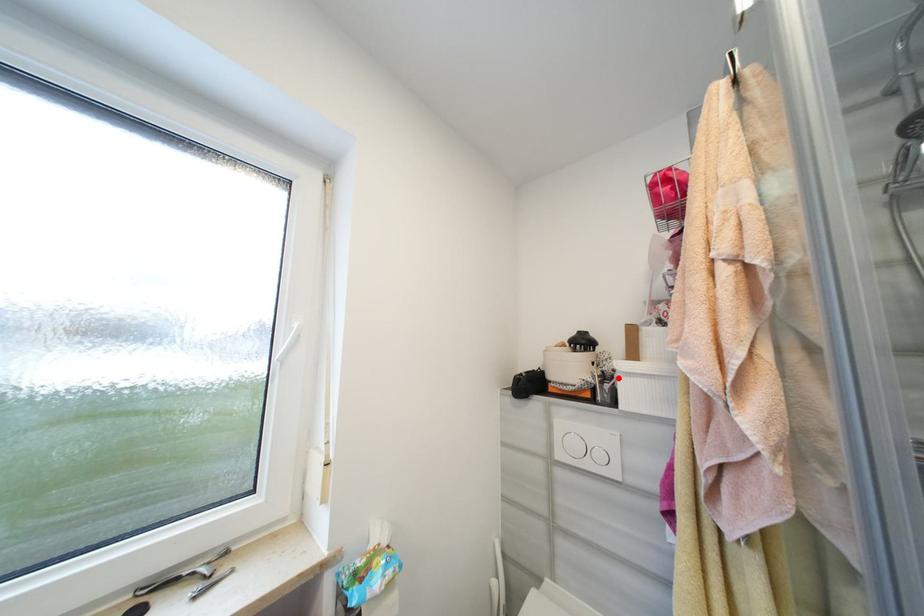
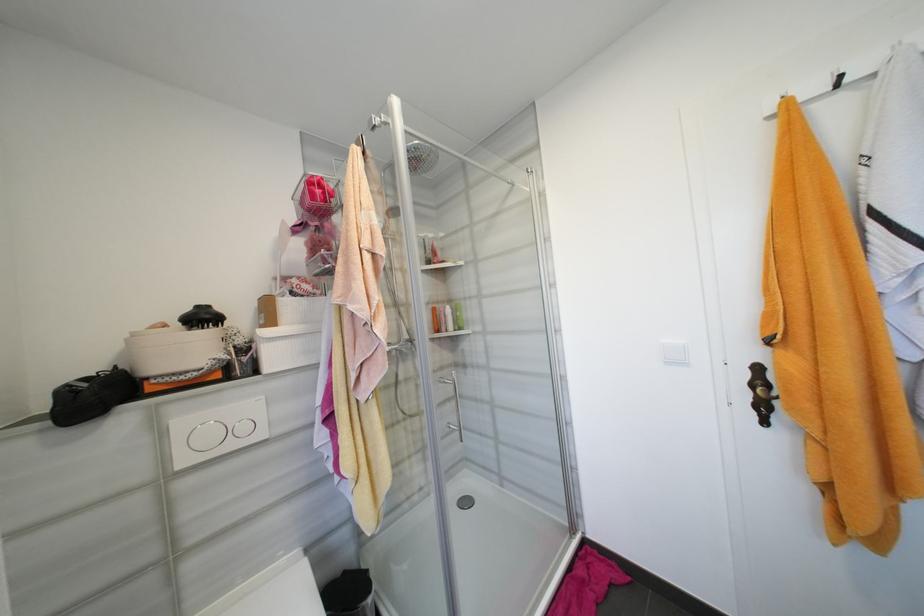
Where in the second image is the point corresponding to the highlighted location from the first image?

(256, 349)